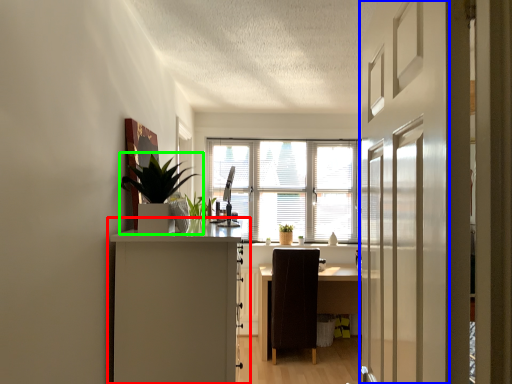
Question: Which object is positioned farthest from cabinetry (highlighted by a red box)? Select from screen door (highlighted by a blue box) and houseplant (highlighted by a green box).

Choices:
 (A) screen door
 (B) houseplant

Answer: (A)